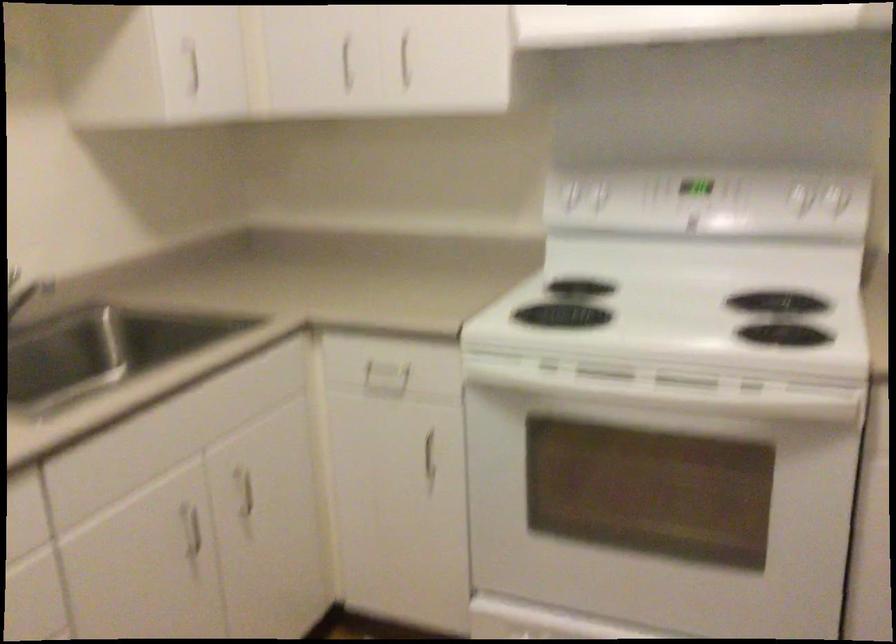
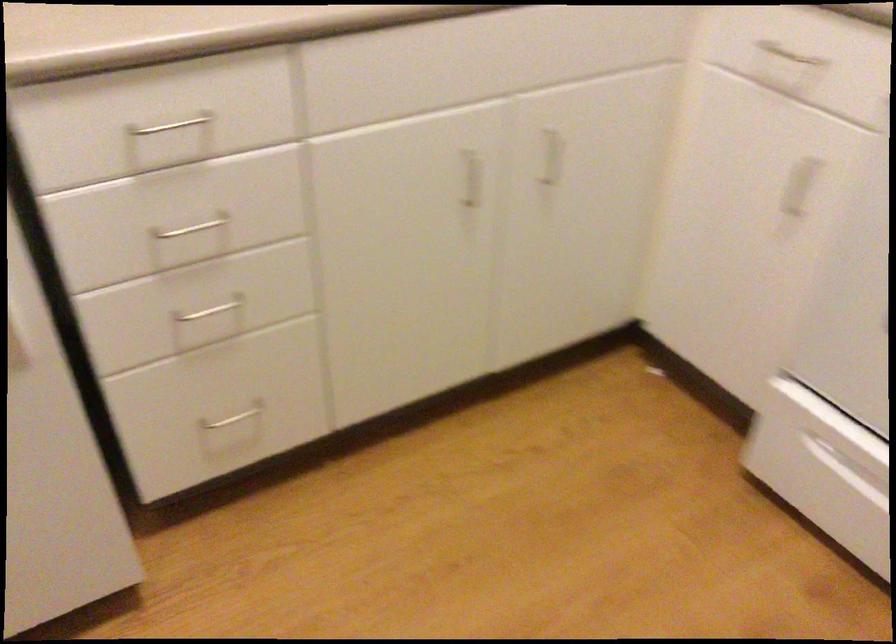
In the second image, find the point that corresponds to pixel 386 368 in the first image.

(789, 55)